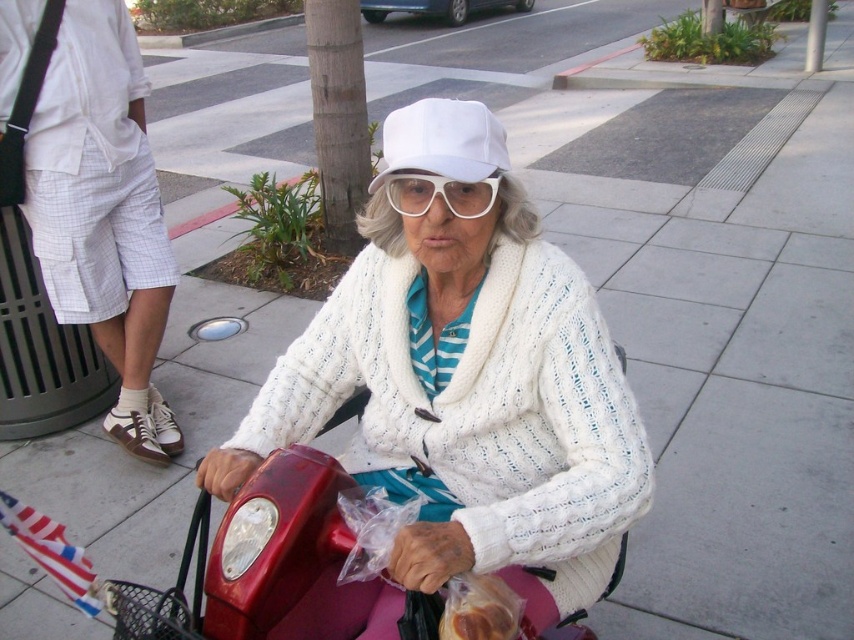
What is the exact coordinate of the white glossy bread at lower center in the image?

The white glossy bread at lower center is located at point (478, 609).

You are a delivery person trying to deliver a package to the elderly woman in the scooter. The package must be placed exactly at point (466, 384). Where should you place the package?

Place the package on the white knitted sweater at center, as the point (466, 384) is on it.

You are standing in front of the elderly woman on the sidewalk. You see two points marked on the ground in front of her scooter. The first point is at coordinates point (502, 164) and the second point is at point (486, 211). Which point is closer to you?

Point (502, 164) is further to the camera than point (486, 211), so the point closer to you is point (486, 211).